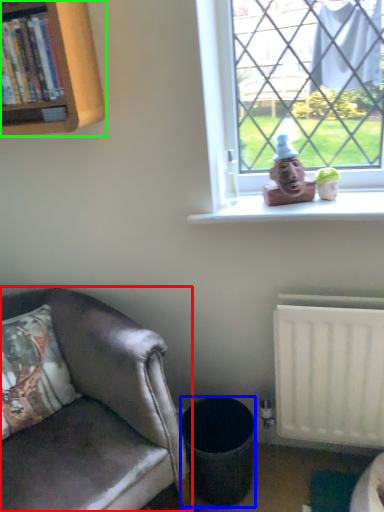
Question: Which object is positioned closest to chair (highlighted by a red box)? Select from trash bin/can (highlighted by a blue box) and bookcase (highlighted by a green box).

Choices:
 (A) trash bin/can
 (B) bookcase

Answer: (A)